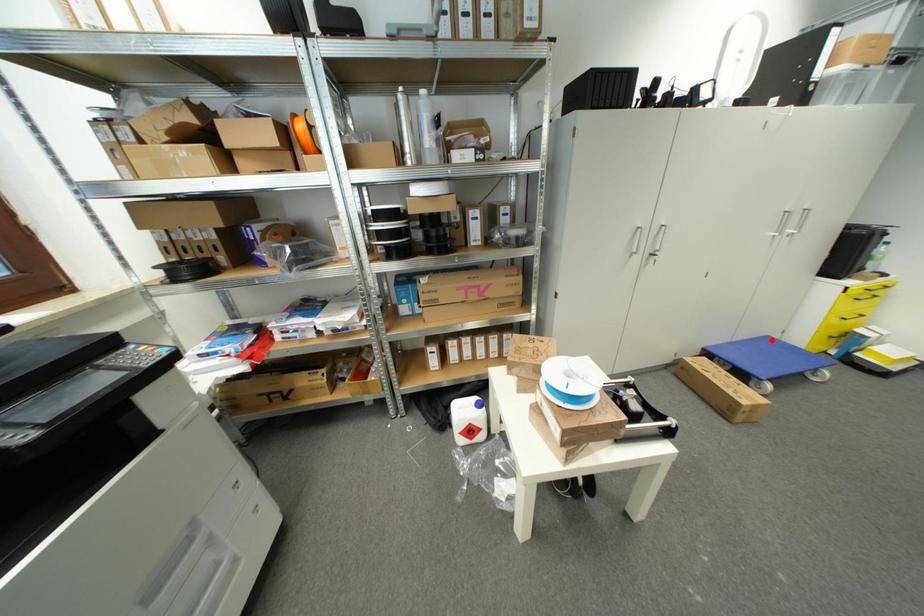
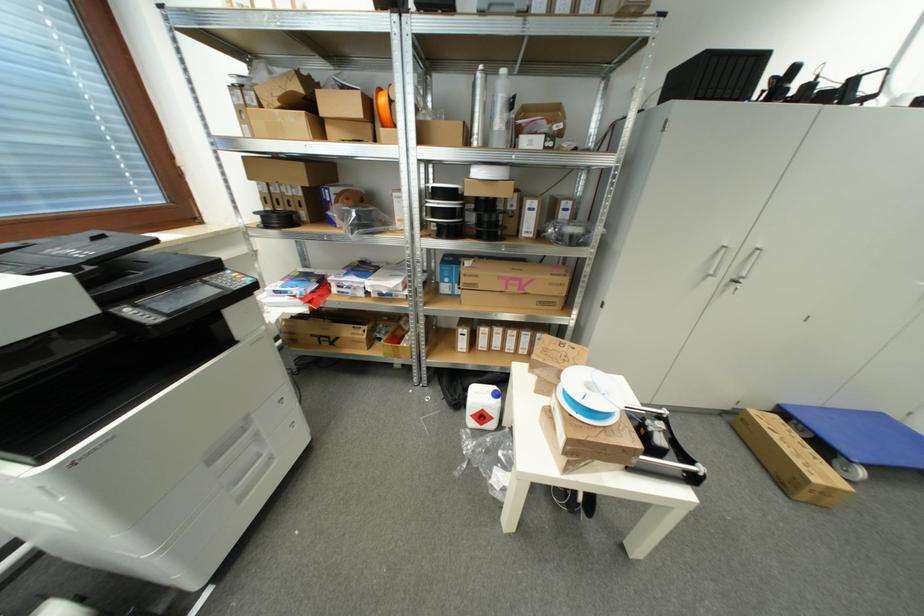
Locate, in the second image, the point that corresponds to the highlighted location in the first image.

(885, 418)